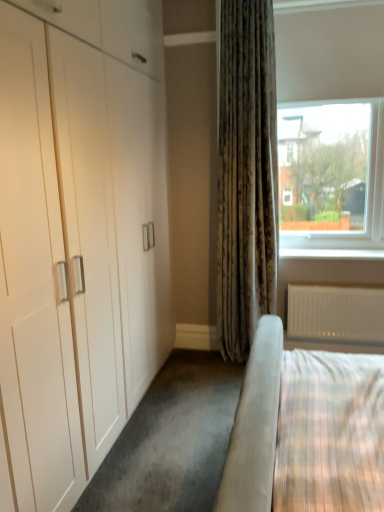
Question: Is white textured radiator at lower right taller than clear glass window at upper right?

Choices:
 (A) yes
 (B) no

Answer: (B)

Question: Is white textured radiator at lower right aimed at clear glass window at upper right?

Choices:
 (A) yes
 (B) no

Answer: (B)

Question: Considering the relative sizes of white textured radiator at lower right and clear glass window at upper right in the image provided, is white textured radiator at lower right smaller than clear glass window at upper right?

Choices:
 (A) yes
 (B) no

Answer: (A)

Question: Is white textured radiator at lower right to the left of clear glass window at upper right from the viewer's perspective?

Choices:
 (A) no
 (B) yes

Answer: (A)

Question: Does white textured radiator at lower right have a lesser height compared to clear glass window at upper right?

Choices:
 (A) no
 (B) yes

Answer: (B)

Question: Considering the relative sizes of white textured radiator at lower right and clear glass window at upper right in the image provided, is white textured radiator at lower right bigger than clear glass window at upper right?

Choices:
 (A) yes
 (B) no

Answer: (B)

Question: Is the position of white smooth window sill at lower right less distant than that of clear glass window at upper right?

Choices:
 (A) yes
 (B) no

Answer: (B)

Question: Is white smooth window sill at lower right taller than clear glass window at upper right?

Choices:
 (A) no
 (B) yes

Answer: (A)

Question: Is white smooth window sill at lower right directly adjacent to clear glass window at upper right?

Choices:
 (A) no
 (B) yes

Answer: (A)

Question: Is white smooth window sill at lower right to the left of clear glass window at upper right from the viewer's perspective?

Choices:
 (A) yes
 (B) no

Answer: (B)

Question: Does white smooth window sill at lower right have a smaller size compared to clear glass window at upper right?

Choices:
 (A) no
 (B) yes

Answer: (B)

Question: Can you confirm if white smooth window sill at lower right is thinner than clear glass window at upper right?

Choices:
 (A) no
 (B) yes

Answer: (B)

Question: Considering the relative sizes of clear glass window at upper right and white textured radiator at lower right in the image provided, is clear glass window at upper right shorter than white textured radiator at lower right?

Choices:
 (A) yes
 (B) no

Answer: (B)